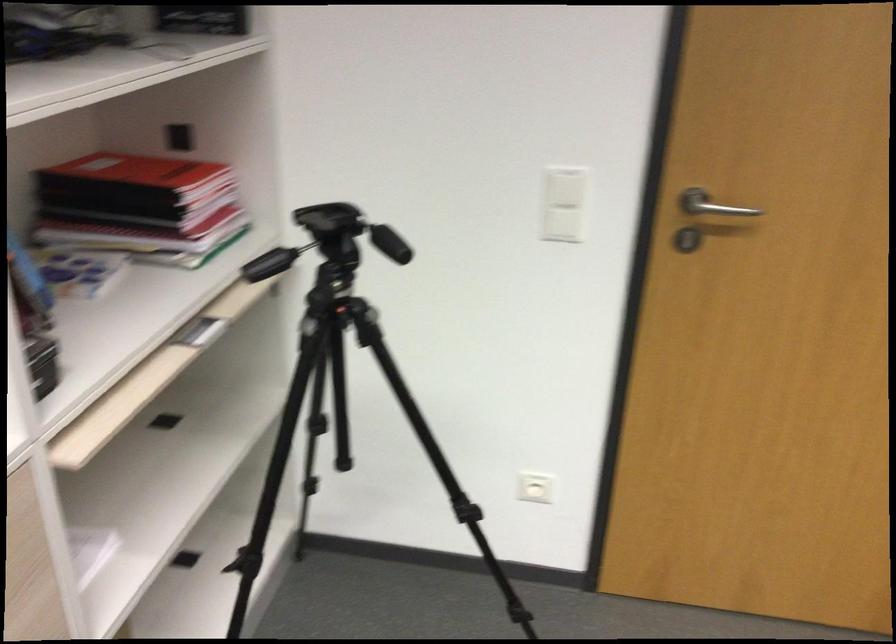
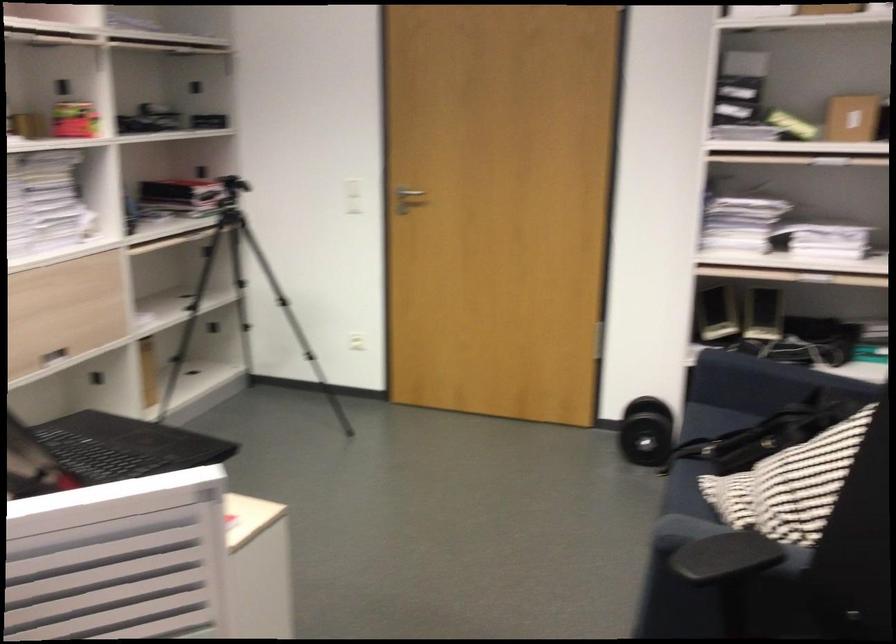
In a continuous first-person perspective shot, in which direction is the camera moving?

The cameraman walked toward right, backward.